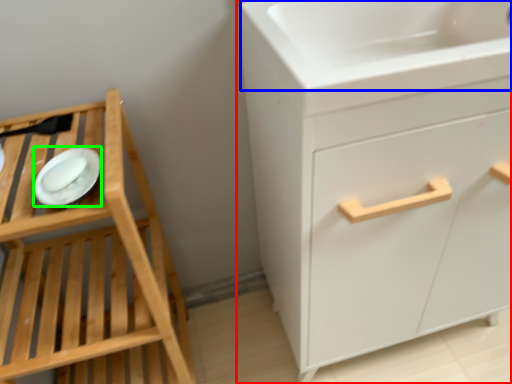
Question: Which object is the farthest from chest of drawers (highlighted by a red box)? Choose among these: sink (highlighted by a blue box) or platter (highlighted by a green box).

Choices:
 (A) sink
 (B) platter

Answer: (B)